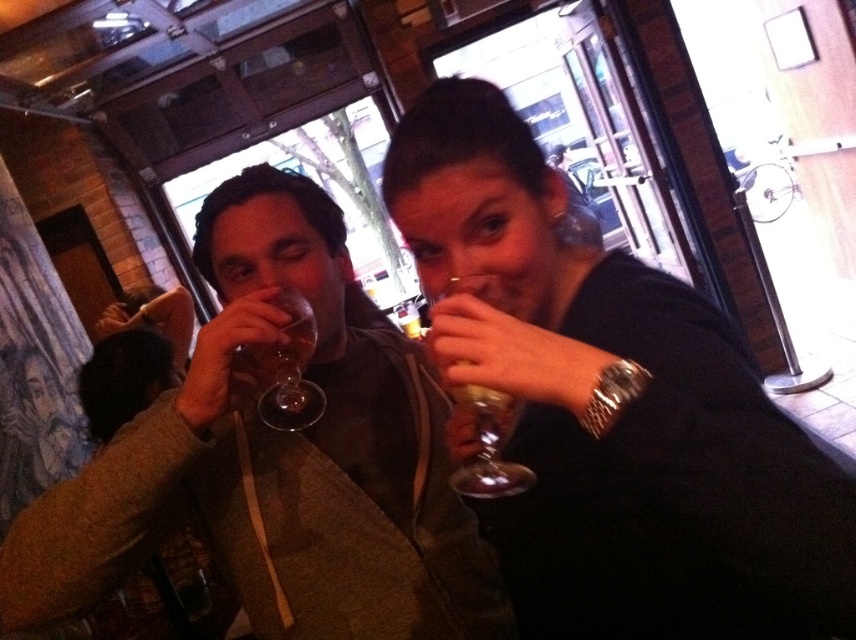
You are a bartender who needs to clean the glasses. You see the transparent glass at upper center and the transparent glass wine glass at center. Which one is easier to reach without moving your current position?

The transparent glass at upper center is closer to the viewer than the transparent glass wine glass at center, so it is easier to reach without moving.

You are a server at the bar. You need to place a new wine glass at the exact location of the point marked at coordinates point (x=270, y=458). What object is currently at that location?

The point (x=270, y=458) marks the location of the matte glass wine glass at center.

You are at a bar with two points marked in the scene. The first point is at coordinates point (483, 636) and the second is at point (492, 451). If you want to place a napkin dispenser between them, which point should be closer to you to ensure the dispenser is placed correctly?

Point (483, 636) is closer to you than point (492, 451), so you should place the napkin dispenser closer to point (483, 636) to ensure it is positioned correctly between them.